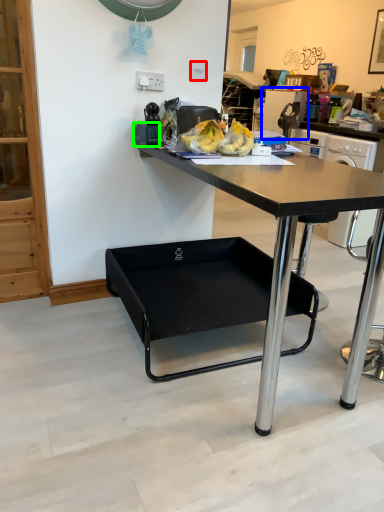
Question: Which object is the closest to the power outlet (highlighted by a red box)? Choose among these: appliance (highlighted by a blue box) or tableware (highlighted by a green box).

Choices:
 (A) appliance
 (B) tableware

Answer: (B)